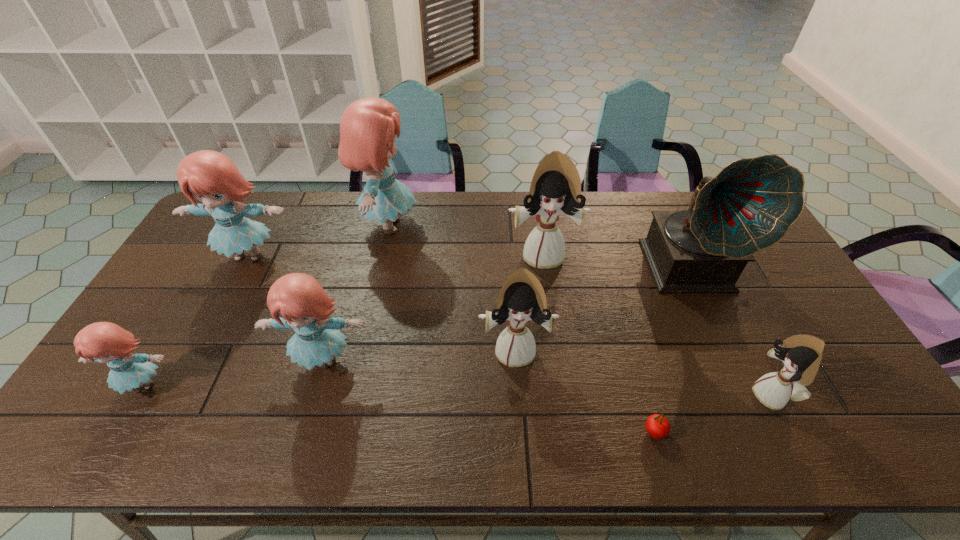
At what (x,y) coordinates should I click in order to perform the action: click on the seventh object from left to right. Please return your answer as a coordinate pair (x, y). The width and height of the screenshot is (960, 540). Looking at the image, I should click on (657, 426).

Identify the location of vacant space located 0.370m on the front-facing side of the biggest blue doll. Image resolution: width=960 pixels, height=540 pixels. (526, 225).

Find the location of a particular element. free space located on the horn of the record player is located at coordinates (771, 434).

Find the location of `free space located 0.400m on the front-facing side of the third smallest blue doll`. free space located 0.400m on the front-facing side of the third smallest blue doll is located at coordinates (178, 392).

You are a GUI agent. You are given a task and a screenshot of the screen. Output one action in this format:
    pyautogui.click(x=<x>, y=<y>)
    Task: Click on the vacant space located 0.360m at the front face of the biggest black doll
    Image resolution: width=960 pixels, height=540 pixels.
    Given the screenshot: What is the action you would take?
    pyautogui.click(x=560, y=372)

Identify the location of vacant area situated on the front-facing side of the second smallest blue doll. [300, 438].

You are a GUI agent. You are given a task and a screenshot of the screen. Output one action in this format:
    pyautogui.click(x=<x>, y=<y>)
    Task: Click on the vacant space situated at the front face of the second smallest black doll
    This screenshot has width=960, height=540.
    Given the screenshot: What is the action you would take?
    pyautogui.click(x=518, y=409)

Where is `free space located 0.150m at the front face of the nearest black doll`? free space located 0.150m at the front face of the nearest black doll is located at coordinates (692, 396).

Identify the location of vacant space located at the front face of the nearest black doll. The height and width of the screenshot is (540, 960). click(676, 396).

I want to click on free region located 0.100m at the front face of the nearest black doll, so click(712, 396).